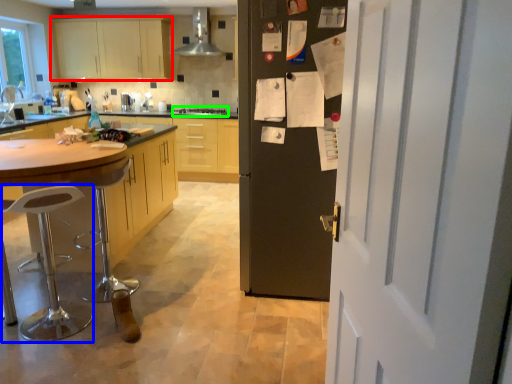
Question: Estimate the real-world distances between objects in this image. Which object is farther from cabinetry (highlighted by a red box), bar stool (highlighted by a blue box) or stove (highlighted by a green box)?

Choices:
 (A) bar stool
 (B) stove

Answer: (A)